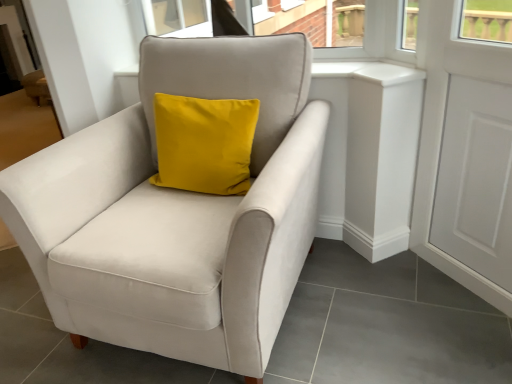
Where is `white matte door at right`? The image size is (512, 384). white matte door at right is located at coordinates (464, 156).

Image resolution: width=512 pixels, height=384 pixels. What do you see at coordinates (464, 156) in the screenshot? I see `white matte door at right` at bounding box center [464, 156].

What is the approximate width of suede-like beige armchair at center?

The width of suede-like beige armchair at center is 3.28 feet.

The image size is (512, 384). In order to click on suede-like beige armchair at center in this screenshot , I will do `click(178, 212)`.

The height and width of the screenshot is (384, 512). What do you see at coordinates (178, 212) in the screenshot? I see `suede-like beige armchair at center` at bounding box center [178, 212].

The image size is (512, 384). Identify the location of white matte door at right. (464, 156).

Between white matte door at right and suede-like beige armchair at center, which one appears on the left side from the viewer's perspective?

Positioned to the left is suede-like beige armchair at center.

Which object is closer to the camera, white matte door at right or suede-like beige armchair at center?

suede-like beige armchair at center.

Does point (425, 101) lie behind point (272, 98)?

That is True.

From the image's perspective, which one is positioned higher, white matte door at right or suede-like beige armchair at center?

white matte door at right appears higher in the image.

From a real-world perspective, is white matte door at right physically below suede-like beige armchair at center?

No, from a real-world perspective, white matte door at right is not beneath suede-like beige armchair at center.

Considering the sizes of objects white matte door at right and suede-like beige armchair at center in the image provided, who is wider, white matte door at right or suede-like beige armchair at center?

suede-like beige armchair at center.

Who is shorter, white matte door at right or suede-like beige armchair at center?

suede-like beige armchair at center is shorter.

Considering the relative sizes of white matte door at right and suede-like beige armchair at center in the image provided, is white matte door at right smaller than suede-like beige armchair at center?

Indeed, white matte door at right has a smaller size compared to suede-like beige armchair at center.

Is white matte door at right not inside suede-like beige armchair at center?

white matte door at right lies outside suede-like beige armchair at center's area.

Is white matte door at right far away from suede-like beige armchair at center?

white matte door at right is actually quite close to suede-like beige armchair at center.

Is white matte door at right looking in the opposite direction of suede-like beige armchair at center?

No, white matte door at right's orientation is not away from suede-like beige armchair at center.

How many degrees apart are the facing directions of white matte door at right and suede-like beige armchair at center?

white matte door at right and suede-like beige armchair at center are facing 43.4 degrees away from each other.

In order to click on chair on the left side of white matte door at right in this screenshot , I will do `click(178, 212)`.

Can you confirm if suede-like beige armchair at center is positioned to the right of white matte door at right?

No.

From the picture: Which object is closer to the camera taking this photo, suede-like beige armchair at center or white matte door at right?

suede-like beige armchair at center is more forward.

Which point is more forward, (80, 168) or (496, 88)?

The point (496, 88) is in front.

From the image's perspective, is suede-like beige armchair at center located beneath white matte door at right?

Yes, from the image's perspective, suede-like beige armchair at center is beneath white matte door at right.

From a real-world perspective, relative to white matte door at right, is suede-like beige armchair at center vertically above or below?

suede-like beige armchair at center is situated lower than white matte door at right in the real world.

Does suede-like beige armchair at center have a lesser width compared to white matte door at right?

No.

Between suede-like beige armchair at center and white matte door at right, which one has less height?

suede-like beige armchair at center is shorter.

Considering the sizes of objects suede-like beige armchair at center and white matte door at right in the image provided, who is bigger, suede-like beige armchair at center or white matte door at right?

Bigger between the two is suede-like beige armchair at center.

Is suede-like beige armchair at center not within white matte door at right?

Absolutely, suede-like beige armchair at center is external to white matte door at right.

Is suede-like beige armchair at center not close to white matte door at right?

No, suede-like beige armchair at center is in close proximity to white matte door at right.

Is suede-like beige armchair at center looking in the opposite direction of white matte door at right?

That's not correct — suede-like beige armchair at center is not looking away from white matte door at right.

How many degrees apart are the facing directions of suede-like beige armchair at center and white matte door at right?

43.4 degrees.

How much distance is there between suede-like beige armchair at center and white matte door at right?

84.10 centimeters.

Find the location of a particular element. This screenshot has height=384, width=512. screen door to the right of suede-like beige armchair at center is located at coordinates (464, 156).

In order to click on screen door that appears above the suede-like beige armchair at center (from the image's perspective) in this screenshot , I will do `click(464, 156)`.

I want to click on screen door that appears behind the suede-like beige armchair at center, so click(x=464, y=156).